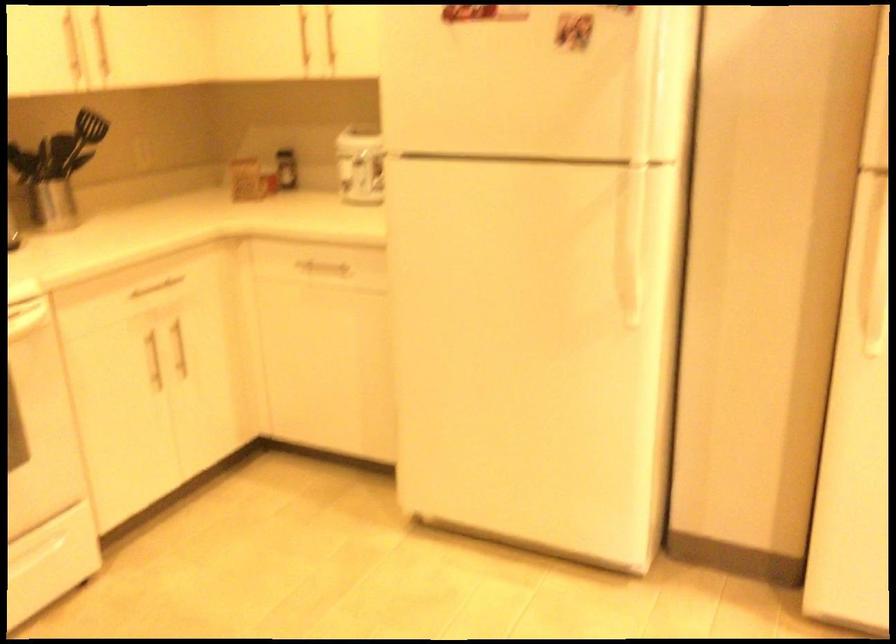
At what (x,y) coordinates should I click in order to perform the action: click on white freezer handle. Please return your answer as a coordinate pair (x, y). Looking at the image, I should click on (634, 277).